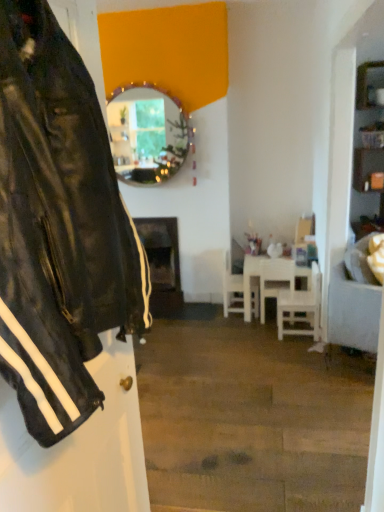
Locate an element on the screen. space that is in front of white matte table at center is located at coordinates (256, 339).